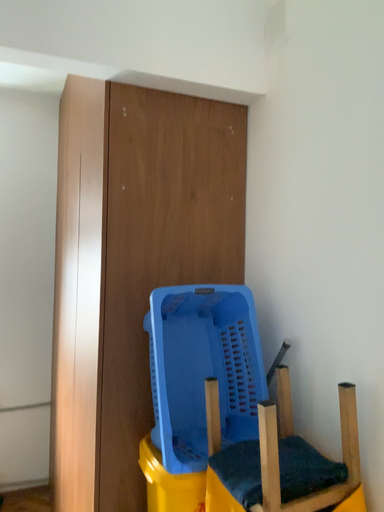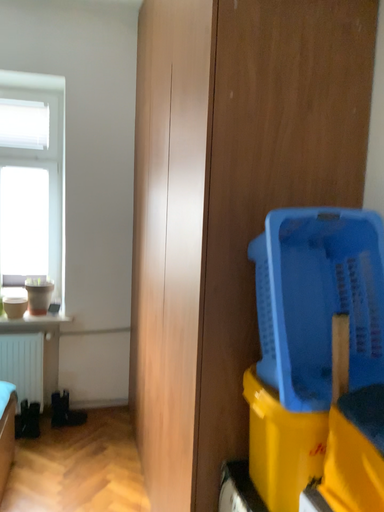
Question: How did the camera likely rotate when shooting the video?

Choices:
 (A) rotated upward
 (B) rotated downward

Answer: (B)